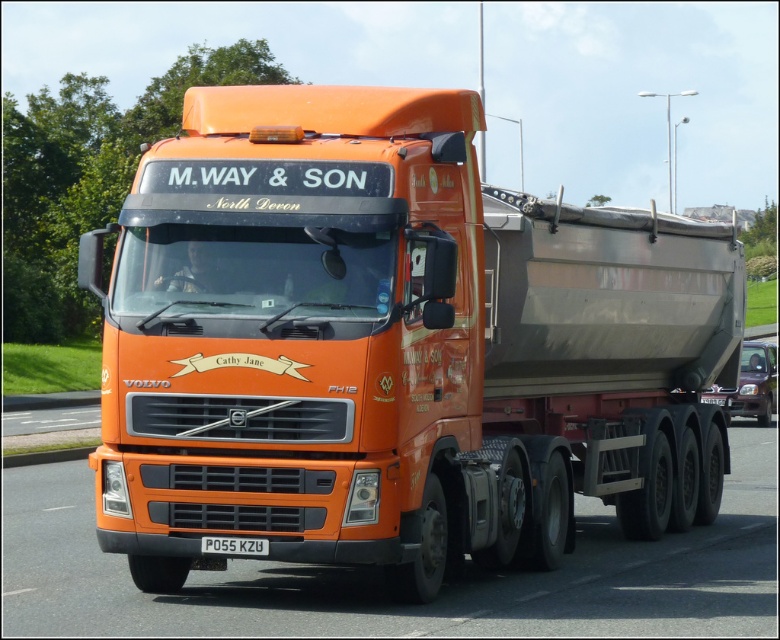
Can you confirm if orange matte truck at center is positioned above red plastic license plate at center?

Indeed, orange matte truck at center is positioned over red plastic license plate at center.

Is point (440, 288) closer to camera compared to point (231, 545)?

No, (440, 288) is behind (231, 545).

I want to click on orange matte truck at center, so click(x=394, y=346).